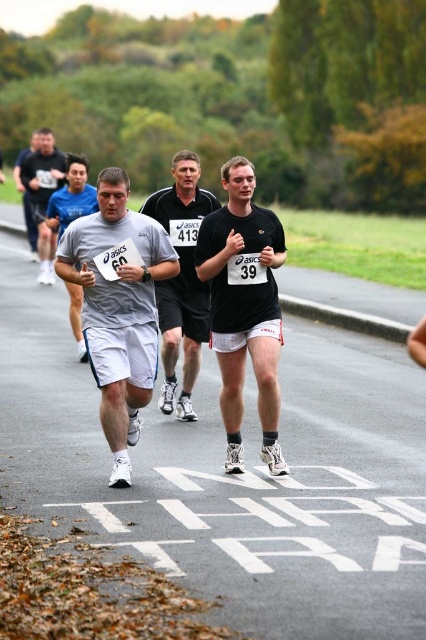
You are a photographer positioned at the starting line of the race. You want to capture a closeup shot of the gray fabric shorts at left. Given that your camera can focus on objects within 5 meters, will you be able to take the photo without moving closer?

The gray fabric shorts at left are 7.10 meters away from the camera, which is beyond the 5 meter focus range. Therefore, you won

You are a race official at the road race. You need to determine if the distance between the black matte shorts at center and the gray fabric shirt at center is within the 10 meter safety zone required for the race. Can you confirm?

The distance between the black matte shorts at center and the gray fabric shirt at center is 12.26 meters, which exceeds the 10 meter safety zone required for the race. Therefore, they are not within the safety zone.

You are a photographer positioned at the starting line of the race. You want to capture a photo that includes both the point at coordinates point (129, 333) and point (166, 369). Which point should you focus on first to ensure both are in sharp focus?

You should focus on point (129, 333) first because it is closer to the viewer, ensuring that both points will be in focus when using a camera with a shallow depth of field.